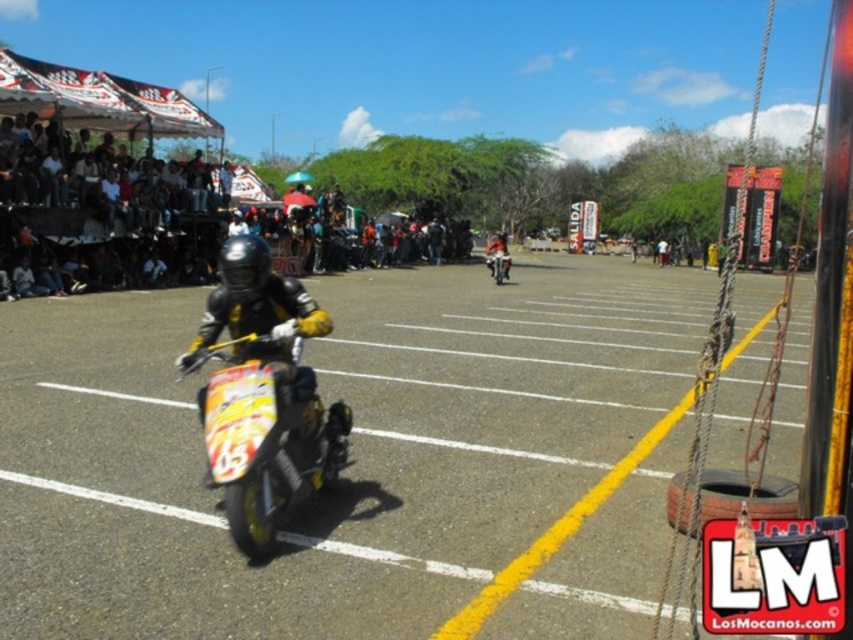
Which is in front, point (341, 234) or point (495, 282)?

Point (495, 282) is in front.

Can you confirm if dark clothing crowd at upper left is wider than yellow matte motorcycle at center?

Yes, dark clothing crowd at upper left is wider than yellow matte motorcycle at center.

Who is more forward, (341,227) or (508,262)?

Point (508,262)

The image size is (853, 640). Identify the location of dark clothing crowd at upper left. (102, 218).

Can you confirm if yellow asphalt at center is thinner than yellow matte motorcycle at center?

No, yellow asphalt at center is not thinner than yellow matte motorcycle at center.

Between yellow asphalt at center and yellow matte motorcycle at center, which one appears on the right side from the viewer's perspective?

Positioned to the right is yellow matte motorcycle at center.

Does point (207, 634) come behind point (498, 278)?

No, it is in front of (498, 278).

Locate an element on the screen. yellow asphalt at center is located at coordinates (360, 461).

Can you confirm if yellow asphalt at center is wider than dark clothing crowd at upper left?

Yes.

Is yellow asphalt at center thinner than dark clothing crowd at upper left?

In fact, yellow asphalt at center might be wider than dark clothing crowd at upper left.

Does point (59, 612) lie behind point (59, 237)?

No, (59, 612) is in front of (59, 237).

Locate an element on the screen. Image resolution: width=853 pixels, height=640 pixels. yellow asphalt at center is located at coordinates (360, 461).